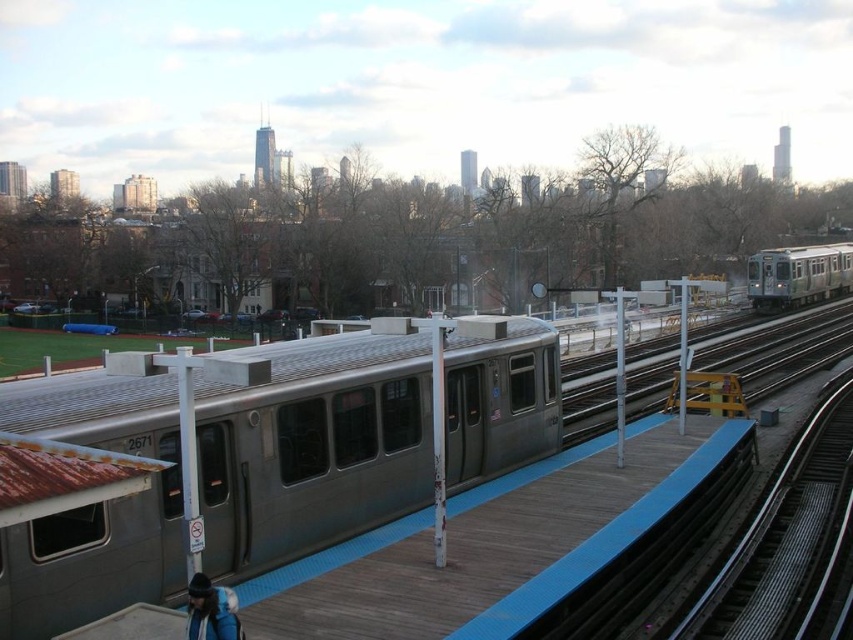
You are a passenger waiting at the train station platform. You see the silver metallic train at center and the smooth steel tracks at right. Which object is closer to the platform edge marked by the blue safety strip?

The silver metallic train at center is closer to the platform edge marked by the blue safety strip because it is positioned to the left of the smooth steel tracks at right, which are further away from the edge.